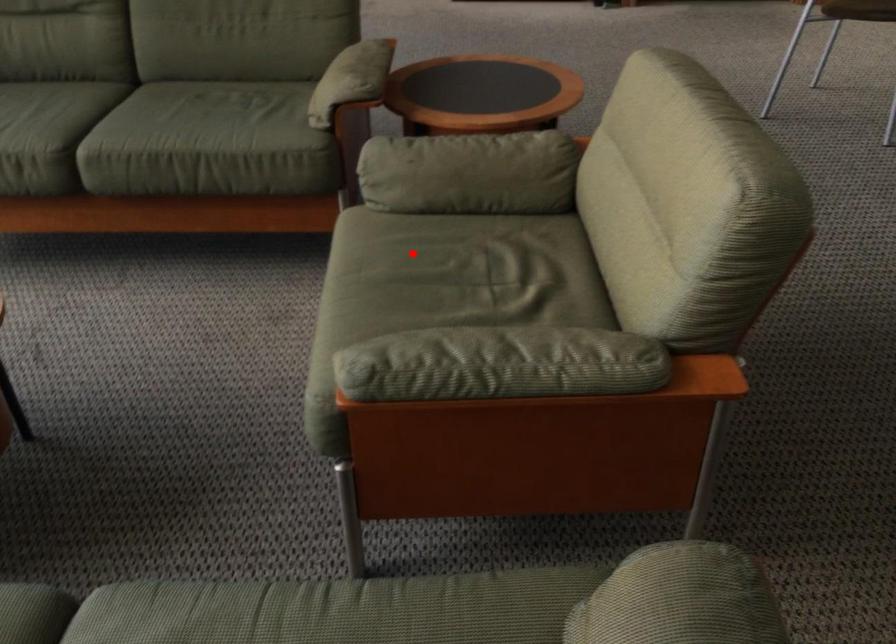
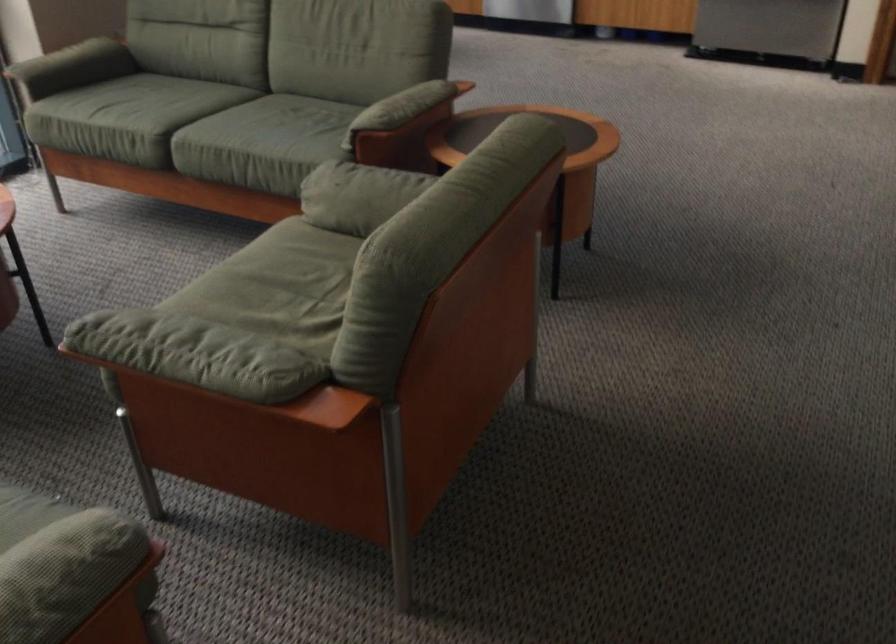
Question: I am providing you with two images of the same scene from different viewpoints. Given a red point in image1, look at the same physical point in image2. Is it:

Choices:
 (A) Closer to the viewpoint
 (B) Farther from the viewpoint

Answer: (B)